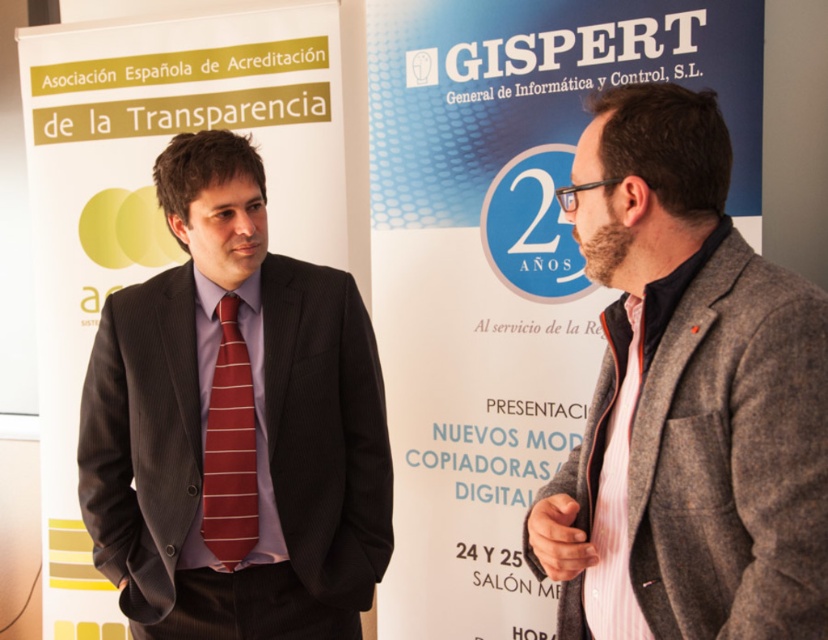
You are standing in front of the two banners at the event. You notice two points marked on the banners. The first point is at coordinates point (190,259) and the second is at point (626,436). Which point is closer to you?

Point (190,259) is further to the camera than point (626,436), so the second point is closer to you.

You are a photographer setting up for a group photo. You need to ensure that both the matte black suit at left and the gray woolen blazer at right are in frame. Given that your camera has a focal length of 50mm and the minimum distance between subjects for clear focus is 30 inches, will the current spacing between them allow for a sharp image of both?

The distance between the matte black suit at left and the gray woolen blazer at right is 31.80 inches, which exceeds the minimum required 30 inches for clear focus. Therefore, the current spacing allows for a sharp image of both subjects.

You are standing in the image and want to locate the gray woolen blazer at right. According to the coordinates provided, where exactly is it positioned?

The gray woolen blazer at right is positioned at the coordinate point 0.617 on the x axis and 0.833 on the y axis.